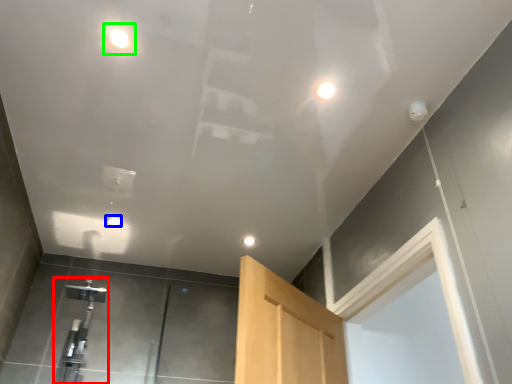
Question: Which is nearer to the faucet (highlighted by a red box)? droplight (highlighted by a blue box) or droplight (highlighted by a green box).

Choices:
 (A) droplight
 (B) droplight

Answer: (A)